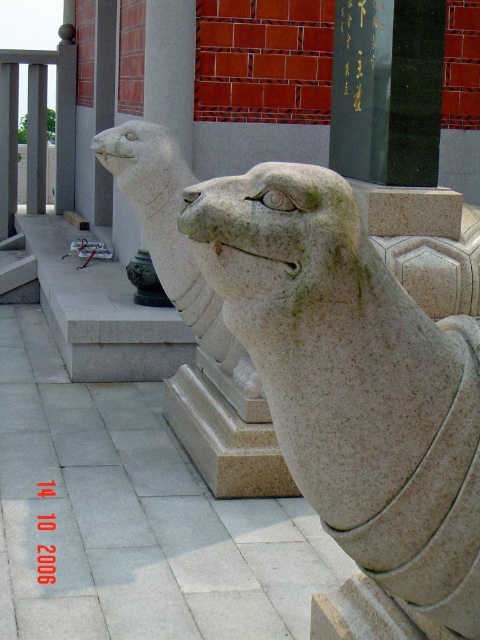
Is granite statue at center positioned behind gray stone lion at center?

No, granite statue at center is in front of gray stone lion at center.

Image resolution: width=480 pixels, height=640 pixels. What do you see at coordinates (352, 380) in the screenshot?
I see `granite statue at center` at bounding box center [352, 380].

Is point (286, 442) positioned behind point (108, 132)?

No, it is in front of (108, 132).

Find the location of a particular element. The image size is (480, 640). granite statue at center is located at coordinates (352, 380).